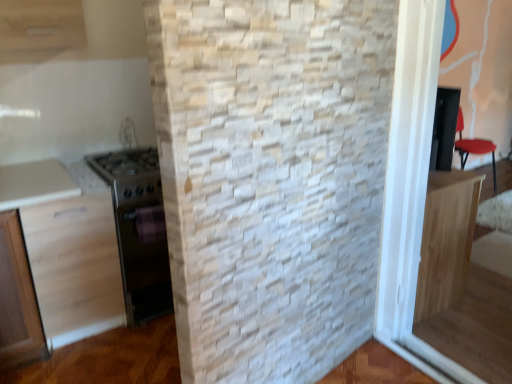
Question: Can you confirm if light wood cabinet at left, which is counted as the 2th cabinetry, starting from the right, is wider than light wood cabinet at right, the 1th cabinetry from the right?

Choices:
 (A) no
 (B) yes

Answer: (B)

Question: Is light wood cabinet at left, arranged as the first cabinetry when viewed from the left, thinner than light wood cabinet at right, the 2th cabinetry positioned from the left?

Choices:
 (A) no
 (B) yes

Answer: (A)

Question: From a real-world perspective, is light wood cabinet at left, which is counted as the 2th cabinetry, starting from the right, under light wood cabinet at right, the 1th cabinetry from the right?

Choices:
 (A) no
 (B) yes

Answer: (A)

Question: Does light wood cabinet at left, which is counted as the 2th cabinetry, starting from the right, contain light wood cabinet at right, the 1th cabinetry from the right?

Choices:
 (A) yes
 (B) no

Answer: (B)

Question: Does light wood cabinet at left, arranged as the first cabinetry when viewed from the left, appear on the left side of light wood cabinet at right, the 1th cabinetry from the right?

Choices:
 (A) yes
 (B) no

Answer: (A)

Question: Is point (453, 228) closer or farther from the camera than point (47, 238)?

Choices:
 (A) closer
 (B) farther

Answer: (B)

Question: Is light wood cabinet at right, the 1th cabinetry from the right, taller or shorter than light wood cabinet at left, which is counted as the 2th cabinetry, starting from the right?

Choices:
 (A) tall
 (B) short

Answer: (B)

Question: Is light wood cabinet at right, the 1th cabinetry from the right, in front of or behind light wood cabinet at left, arranged as the first cabinetry when viewed from the left, in the image?

Choices:
 (A) front
 (B) behind

Answer: (B)

Question: Is light wood cabinet at right, the 1th cabinetry from the right, inside or outside of light wood cabinet at left, which is counted as the 2th cabinetry, starting from the right?

Choices:
 (A) outside
 (B) inside

Answer: (A)

Question: Is light wood cabinet at left, which is counted as the 2th cabinetry, starting from the right, wider or thinner than metallic stainless steel oven at left?

Choices:
 (A) thin
 (B) wide

Answer: (A)

Question: Considering the positions of point (42, 349) and point (120, 200), is point (42, 349) closer or farther from the camera than point (120, 200)?

Choices:
 (A) farther
 (B) closer

Answer: (A)

Question: Is light wood cabinet at left, arranged as the first cabinetry when viewed from the left, situated inside metallic stainless steel oven at left or outside?

Choices:
 (A) outside
 (B) inside

Answer: (A)

Question: Considering the positions of light wood cabinet at left, which is counted as the 2th cabinetry, starting from the right, and metallic stainless steel oven at left in the image, is light wood cabinet at left, which is counted as the 2th cabinetry, starting from the right, taller or shorter than metallic stainless steel oven at left?

Choices:
 (A) tall
 (B) short

Answer: (A)

Question: Is metallic stainless steel oven at left in front of or behind light wood cabinet at left, which is counted as the 2th cabinetry, starting from the right, in the image?

Choices:
 (A) front
 (B) behind

Answer: (B)

Question: Looking at the image, does metallic stainless steel oven at left seem bigger or smaller compared to light wood cabinet at left, which is counted as the 2th cabinetry, starting from the right?

Choices:
 (A) big
 (B) small

Answer: (A)